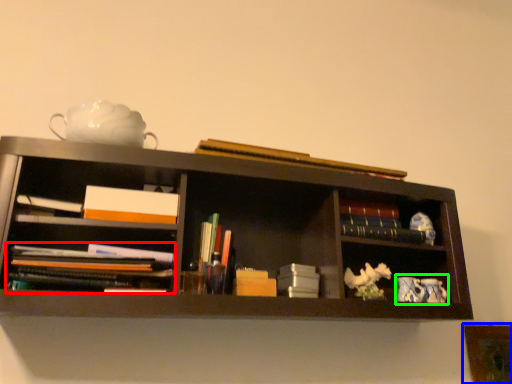
Question: Based on their relative distances, which object is nearer to book (highlighted by a red box)? Choose from picture frame (highlighted by a blue box) and tea set (highlighted by a green box).

Choices:
 (A) picture frame
 (B) tea set

Answer: (B)